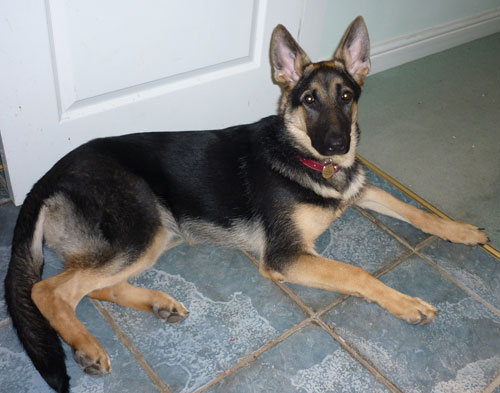
Find the location of a particular element. Image resolution: width=500 pixels, height=393 pixels. door is located at coordinates (165, 113).